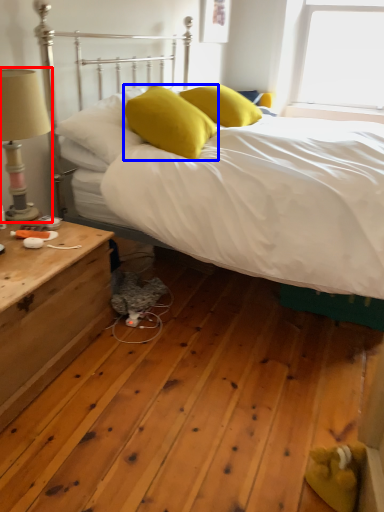
Question: Which of the following is the farthest to the observer, table lamp (highlighted by a red box) or pillow (highlighted by a blue box)?

Choices:
 (A) table lamp
 (B) pillow

Answer: (B)